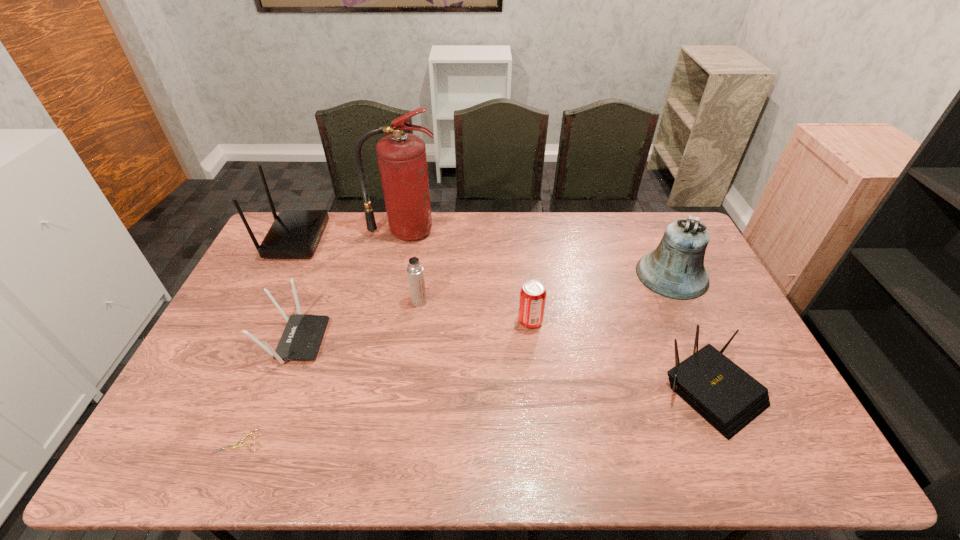
Identify the location of vacant region located 0.220m on the front-facing side of the farthest router. The image size is (960, 540). (382, 239).

The image size is (960, 540). Identify the location of blank space located 0.370m on the left of the bell. (528, 275).

Locate an element on the screen. The width and height of the screenshot is (960, 540). vacant space located 0.120m on the front of the thermos bottle is located at coordinates (415, 336).

The width and height of the screenshot is (960, 540). In order to click on vacant space situated 0.130m on the front of the sixth object from left to right in this screenshot , I will do `click(535, 367)`.

You are a GUI agent. You are given a task and a screenshot of the screen. Output one action in this format:
    pyautogui.click(x=<x>, y=<y>)
    Task: Click on the vacant space located 0.150m on the front-facing side of the second tallest router
    Image resolution: width=960 pixels, height=540 pixels.
    Given the screenshot: What is the action you would take?
    pyautogui.click(x=375, y=340)

Where is `vacant space located 0.210m on the left of the second shortest object`? vacant space located 0.210m on the left of the second shortest object is located at coordinates (582, 392).

Where is `vacant space located 0.050m on the right of the shears`? Image resolution: width=960 pixels, height=540 pixels. vacant space located 0.050m on the right of the shears is located at coordinates (282, 441).

Where is `fire extinguisher located at the far edge`? This screenshot has height=540, width=960. fire extinguisher located at the far edge is located at coordinates (402, 161).

At what (x,y) coordinates should I click in order to perform the action: click on router that is at the far edge. Please return your answer as a coordinate pair (x, y). Image resolution: width=960 pixels, height=540 pixels. Looking at the image, I should click on (295, 233).

Where is `router present at the near edge`? The width and height of the screenshot is (960, 540). router present at the near edge is located at coordinates (726, 396).